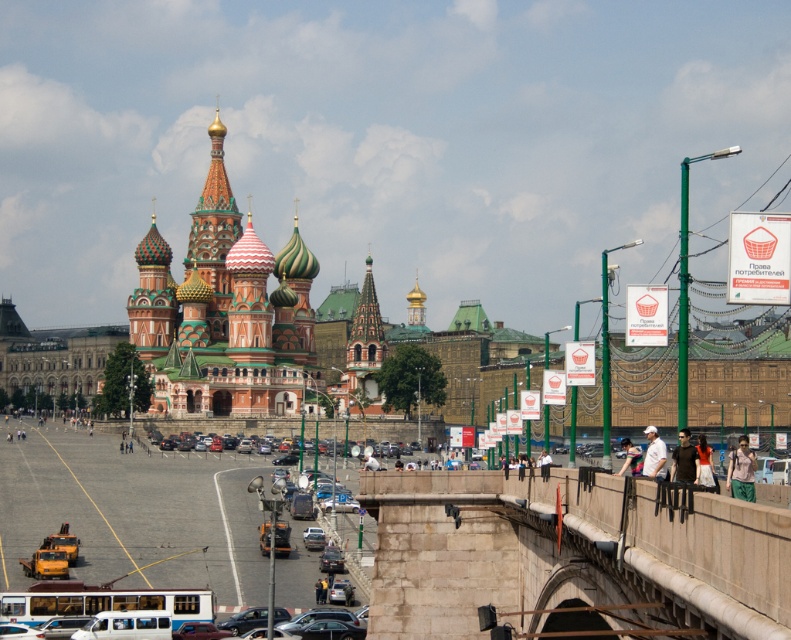
At what (x,y) coordinates should I click in order to perform the action: click on stone bridge at center. Please return your answer as a coordinate pair (x, y). The height and width of the screenshot is (640, 791). Looking at the image, I should click on (570, 554).

Is stone bridge at center taller than white cotton shirt at right?

Yes.

Find the location of a particular element. The width and height of the screenshot is (791, 640). stone bridge at center is located at coordinates (570, 554).

Can you confirm if stone bridge at center is wider than brown leather jacket at lower right?

Yes, stone bridge at center is wider than brown leather jacket at lower right.

From the picture: Who is more forward, (742, 632) or (680, 449)?

Point (742, 632) is in front.

Where is `stone bridge at center`? stone bridge at center is located at coordinates (570, 554).

Is white cotton shirt at right further to the viewer compared to light blue denim jeans at lower right?

No.

Does white cotton shirt at right have a lesser width compared to light blue denim jeans at lower right?

Incorrect, white cotton shirt at right's width is not less than light blue denim jeans at lower right's.

At what (x,y) coordinates should I click in order to perform the action: click on white cotton shirt at right. Please return your answer as a coordinate pair (x, y). The image size is (791, 640). Looking at the image, I should click on tap(653, 454).